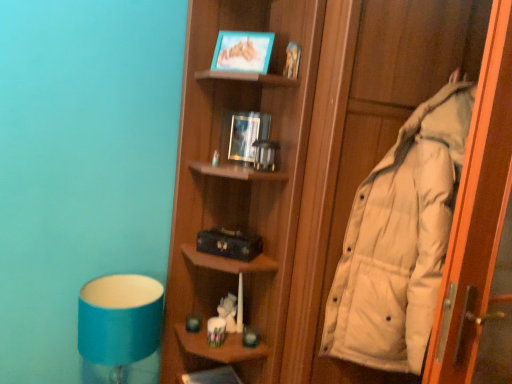
At what (x,y) coordinates should I click in order to perform the action: click on blue fabric lampshade at lower left. Please return your answer as a coordinate pair (x, y). Looking at the image, I should click on (120, 321).

Locate an element on the screen. This screenshot has width=512, height=384. blue fabric lampshade at lower left is located at coordinates (120, 321).

Can you tell me how much wooden shelf at lower center and white down jacket at right differ in facing direction?

The angular difference between wooden shelf at lower center and white down jacket at right is 3.04 degrees.

Is point (182, 378) less distant than point (340, 265)?

No, (182, 378) is behind (340, 265).

Would you say wooden shelf at lower center contains white down jacket at right?

Actually, white down jacket at right is outside wooden shelf at lower center.

Is wooden shelf at lower center thinner than white down jacket at right?

Indeed, wooden shelf at lower center has a lesser width compared to white down jacket at right.

How many degrees apart are the facing directions of white down jacket at right and white down jacket at right?

There is a 0.376-degree angle between the facing directions of white down jacket at right and white down jacket at right.

Which of these two, white down jacket at right or white down jacket at right, stands shorter?

white down jacket at right is shorter.

Does white down jacket at right have a greater width compared to white down jacket at right?

Yes.

Is white down jacket at right further to the viewer compared to white down jacket at right?

Yes, white down jacket at right is further from the viewer.

Considering the sizes of objects white down jacket at right and white down jacket at right in the image provided, who is taller, white down jacket at right or white down jacket at right?

With more height is white down jacket at right.

Do you think white down jacket at right is within white down jacket at right, or outside of it?

white down jacket at right is spatially situated outside white down jacket at right.

Measure the distance between white down jacket at right and white down jacket at right.

white down jacket at right is 7.56 inches away from white down jacket at right.

Does white down jacket at right come behind white down jacket at right?

No.

Can you confirm if white down jacket at right is bigger than wooden shelf at lower center?

Indeed, white down jacket at right has a larger size compared to wooden shelf at lower center.

Would you consider white down jacket at right to be distant from wooden shelf at lower center?

Absolutely, white down jacket at right is distant from wooden shelf at lower center.

Between point (496, 254) and point (221, 368), which one is positioned behind?

The point (221, 368) is more distant.

Which is behind, white down jacket at right or wooden shelf at lower center?

wooden shelf at lower center.

Considering the points (106, 320) and (441, 275), which point is behind, point (106, 320) or point (441, 275)?

The point (106, 320) is farther from the camera.

Could you tell me if blue fabric lampshade at lower left is turned towards white down jacket at right?

No, blue fabric lampshade at lower left is not facing towards white down jacket at right.

Can you confirm if blue fabric lampshade at lower left is bigger than white down jacket at right?

No, blue fabric lampshade at lower left is not bigger than white down jacket at right.

Does blue fabric lampshade at lower left touch white down jacket at right?

blue fabric lampshade at lower left is not next to white down jacket at right, and they're not touching.

From the image's perspective, which object appears higher, white down jacket at right or wooden shelf at lower center?

white down jacket at right, from the image's perspective.

Which of these two, white down jacket at right or wooden shelf at lower center, is thinner?

wooden shelf at lower center is thinner.

At what (x,y) coordinates should I click in order to perform the action: click on coat on the right of the wooden shelf at lower center. Please return your answer as a coordinate pair (x, y). Looking at the image, I should click on (400, 240).

Which is more to the left, white down jacket at right or wooden shelf at lower center?

From the viewer's perspective, wooden shelf at lower center appears more on the left side.

Is white down jacket at right oriented towards blue fabric lampshade at lower left?

No, white down jacket at right is not facing towards blue fabric lampshade at lower left.

Can you confirm if white down jacket at right is shorter than blue fabric lampshade at lower left?

No.

Can you tell me how much white down jacket at right and blue fabric lampshade at lower left differ in facing direction?

They differ by 2.32 degrees in their facing directions.

This screenshot has width=512, height=384. I want to click on coat above the wooden shelf at lower center (from a real-world perspective), so click(x=400, y=240).

Identify the location of coat that is behind the white down jacket at right. The width and height of the screenshot is (512, 384). (400, 240).

Considering their positions, is white down jacket at right positioned closer to wooden shelf at lower center than white down jacket at right?

The object closer to wooden shelf at lower center is white down jacket at right.

Considering their positions, is blue fabric lampshade at lower left positioned further to wooden shelf at lower center than white down jacket at right?

white down jacket at right lies further to wooden shelf at lower center than the other object.

When comparing their distances from white down jacket at right, does white down jacket at right or blue fabric lampshade at lower left seem closer?

Based on the image, white down jacket at right appears to be nearer to white down jacket at right.

Based on their spatial positions, is white down jacket at right or blue fabric lampshade at lower left closer to wooden shelf at lower center?

The object closer to wooden shelf at lower center is blue fabric lampshade at lower left.

Looking at this image, based on their spatial positions, is white down jacket at right or white down jacket at right further from wooden shelf at lower center?

Among the two, white down jacket at right is located further to wooden shelf at lower center.

Considering their positions, is white down jacket at right positioned closer to blue fabric lampshade at lower left than white down jacket at right?

white down jacket at right is positioned closer to the anchor blue fabric lampshade at lower left.

Based on their spatial positions, is white down jacket at right or wooden shelf at lower center closer to white down jacket at right?

white down jacket at right.

Considering their positions, is wooden shelf at lower center positioned further to white down jacket at right than blue fabric lampshade at lower left?

wooden shelf at lower center lies further to white down jacket at right than the other object.

Locate an element on the screen. The width and height of the screenshot is (512, 384). coat between blue fabric lampshade at lower left and white down jacket at right in the horizontal direction is located at coordinates (400, 240).

You are a GUI agent. You are given a task and a screenshot of the screen. Output one action in this format:
    pyautogui.click(x=<x>, y=<y>)
    Task: Click on the coat between wooden shelf at lower center and white down jacket at right in the horizontal direction
    Image resolution: width=512 pixels, height=384 pixels.
    Given the screenshot: What is the action you would take?
    pyautogui.click(x=400, y=240)

Where is `shelf between blue fabric lampshade at lower left and white down jacket at right`? The width and height of the screenshot is (512, 384). shelf between blue fabric lampshade at lower left and white down jacket at right is located at coordinates (211, 376).

Image resolution: width=512 pixels, height=384 pixels. I want to click on shelf between blue fabric lampshade at lower left and white down jacket at right from left to right, so click(x=211, y=376).